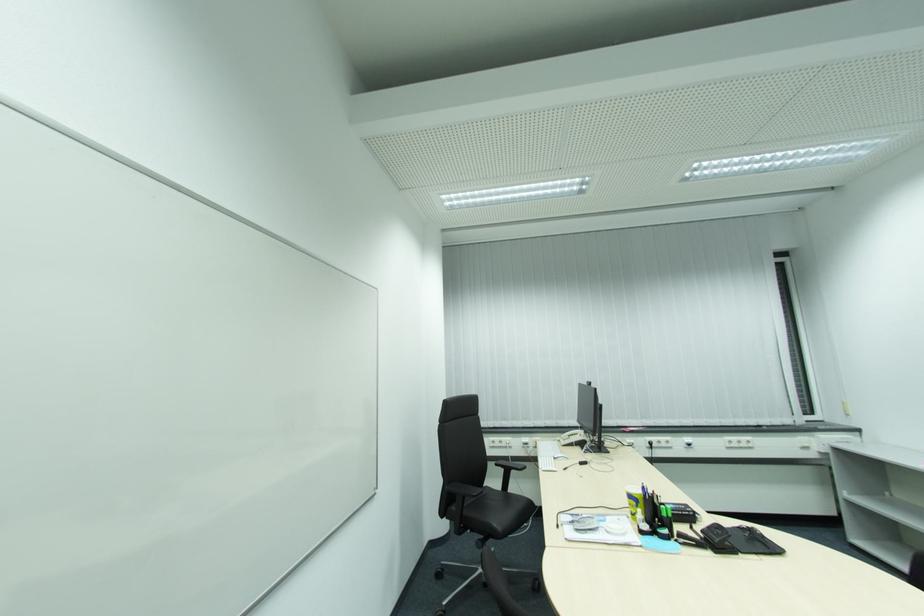
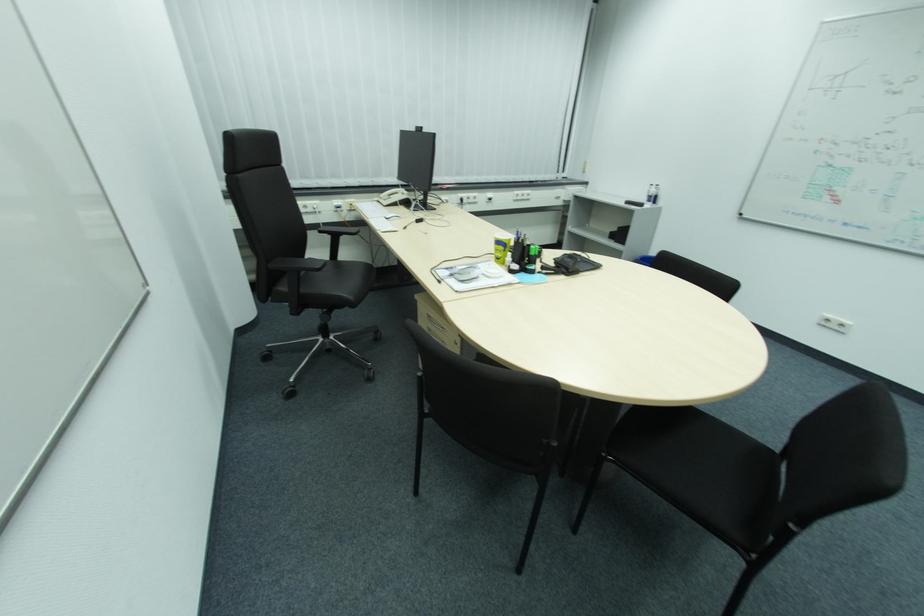
Where in the second image is the point corresponding to the point at 491,485 from the first image?

(311, 257)